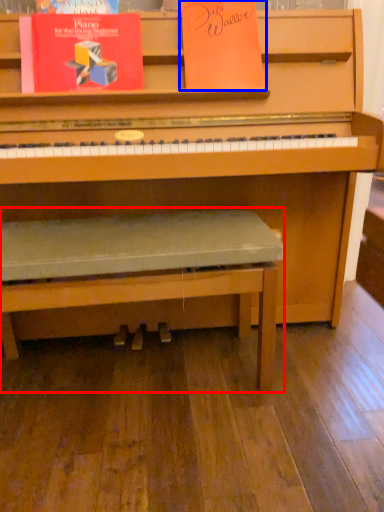
Question: Which point is closer to the camera, church bench (highlighted by a red box) or paperback book (highlighted by a blue box)?

Choices:
 (A) church bench
 (B) paperback book

Answer: (A)